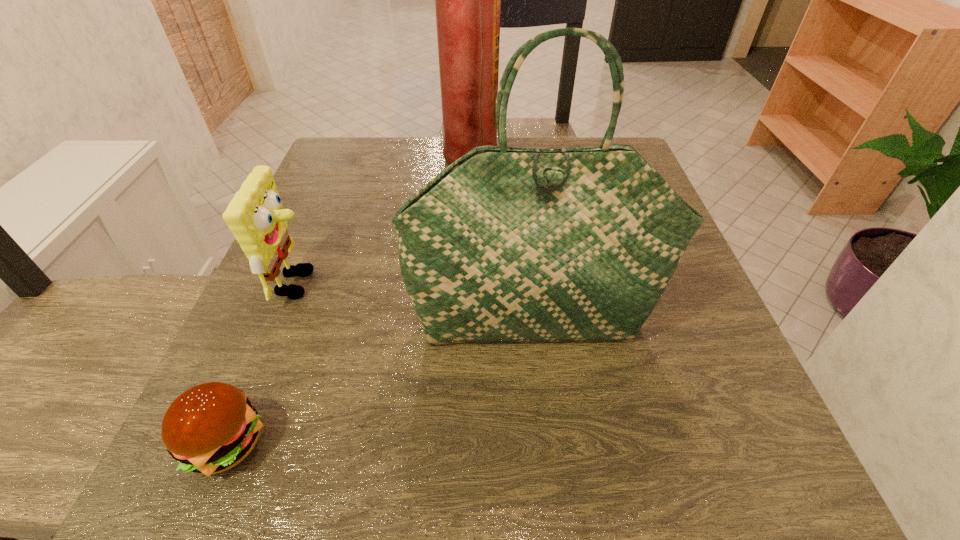
Where is `free location that satisfies the following two spatial constraints: 1. on the side of the fire extinguisher with the label; 2. on the front side of the hamburger`? free location that satisfies the following two spatial constraints: 1. on the side of the fire extinguisher with the label; 2. on the front side of the hamburger is located at coordinates (456, 443).

Where is `free space in the image that satisfies the following two spatial constraints: 1. on the side of the farthest object with the label; 2. on the back side of the tote bag`? This screenshot has height=540, width=960. free space in the image that satisfies the following two spatial constraints: 1. on the side of the farthest object with the label; 2. on the back side of the tote bag is located at coordinates (461, 322).

Locate an element on the screen. Image resolution: width=960 pixels, height=540 pixels. vacant space that satisfies the following two spatial constraints: 1. on the face of the tote bag; 2. on the right side of the sponge is located at coordinates (284, 322).